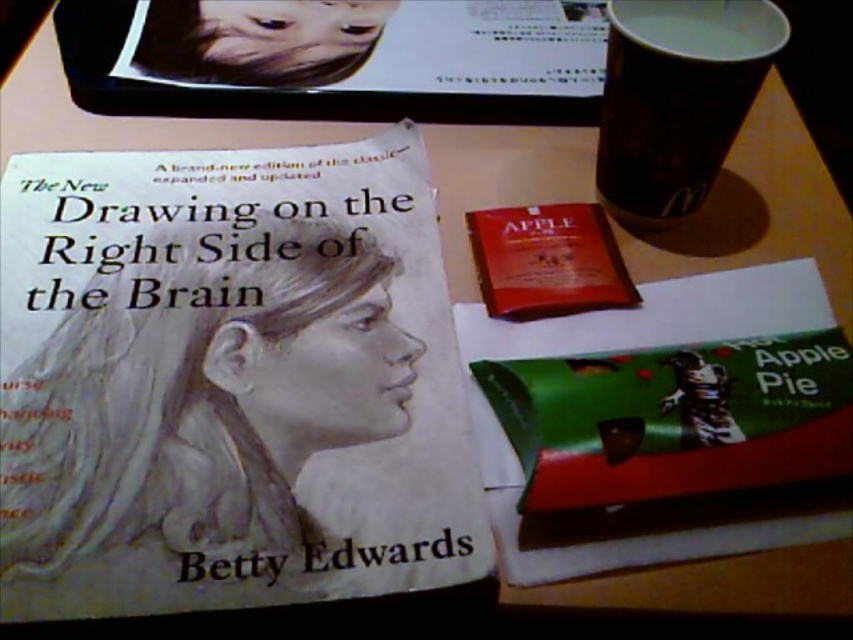
I want to click on matte white book at center, so click(228, 381).

Does matte white book at center have a greater width compared to white paper cup at upper right?

Yes.

Is matte white book at center shorter than white paper cup at upper right?

In fact, matte white book at center may be taller than white paper cup at upper right.

This screenshot has height=640, width=853. What do you see at coordinates (228, 381) in the screenshot?
I see `matte white book at center` at bounding box center [228, 381].

Where is `matte white book at center`? Image resolution: width=853 pixels, height=640 pixels. matte white book at center is located at coordinates (228, 381).

Between point (207, 496) and point (682, 458), which one is positioned in front?

Point (682, 458)

Locate an element on the screen. This screenshot has height=640, width=853. matte white book at center is located at coordinates (228, 381).